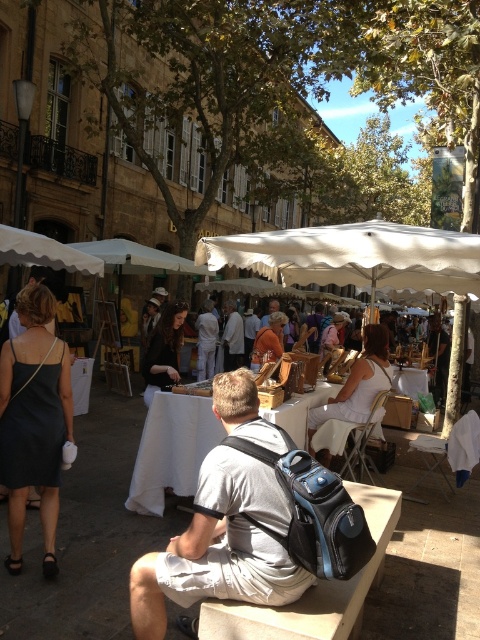
You are a traveler who wants to place both the gray fabric backpack at center and the light brown leather jacket at center on a narrow shelf. Which item should you place first to ensure both fit?

Since the gray fabric backpack at center is wider than the light brown leather jacket at center, you should place the wider gray fabric backpack at center first to ensure both items can fit on the narrow shelf.